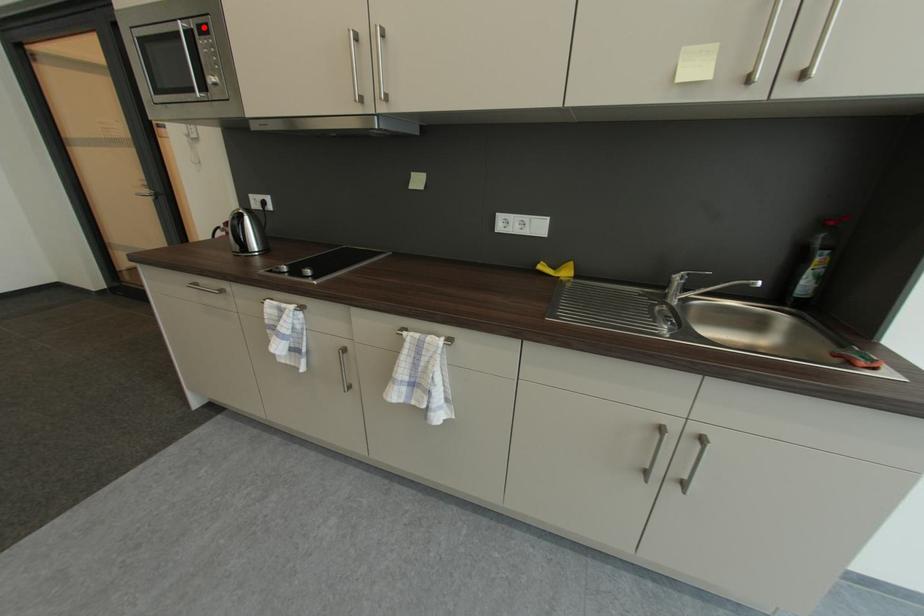
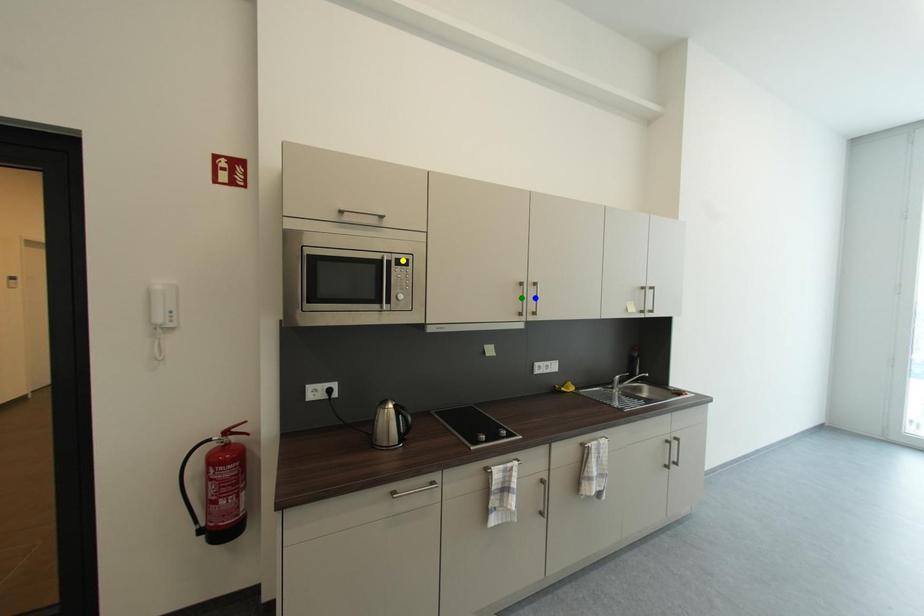
Question: I am providing you with two images of the same scene from different viewpoints. A red point is marked on the first image. You are given multiple points on the second image. Which mark in image 2 goes with the point in image 1?

Choices:
 (A) blue point
 (B) yellow point
 (C) green point

Answer: (B)